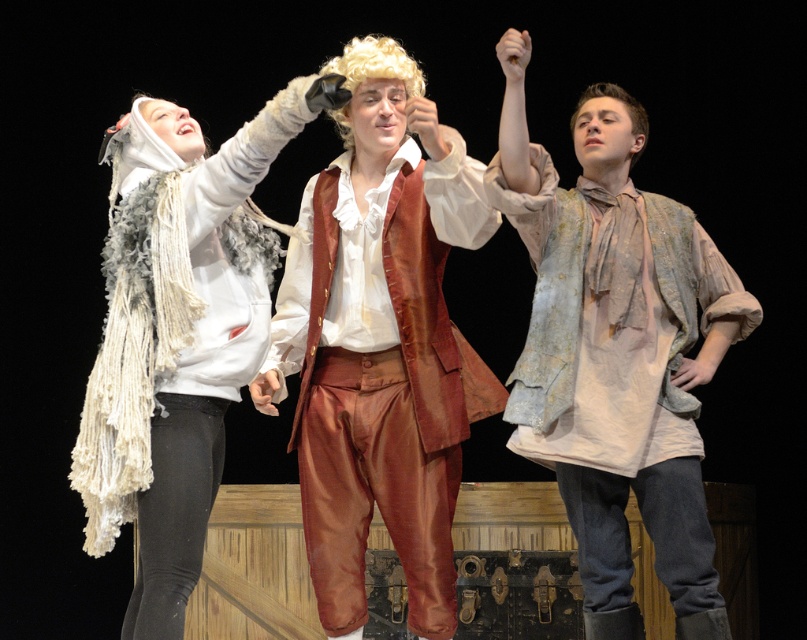
You are an audience member sitting in the front row of the theater. You notice two items on stage, the distressed white shirt at center and the white fluffy scarf at upper left. Which item is positioned closer to the right side of the stage?

The distressed white shirt at center is positioned to the right of the white fluffy scarf at upper left, so the distressed white shirt at center is closer to the right side of the stage.

You are an audience member sitting in the front row of the theater. You notice the distressed white shirt at center and the white fluffy scarf at upper left. Which one appears closer to you?

The distressed white shirt at center is closer to you because it is positioned further to the viewer than the white fluffy scarf at upper left.